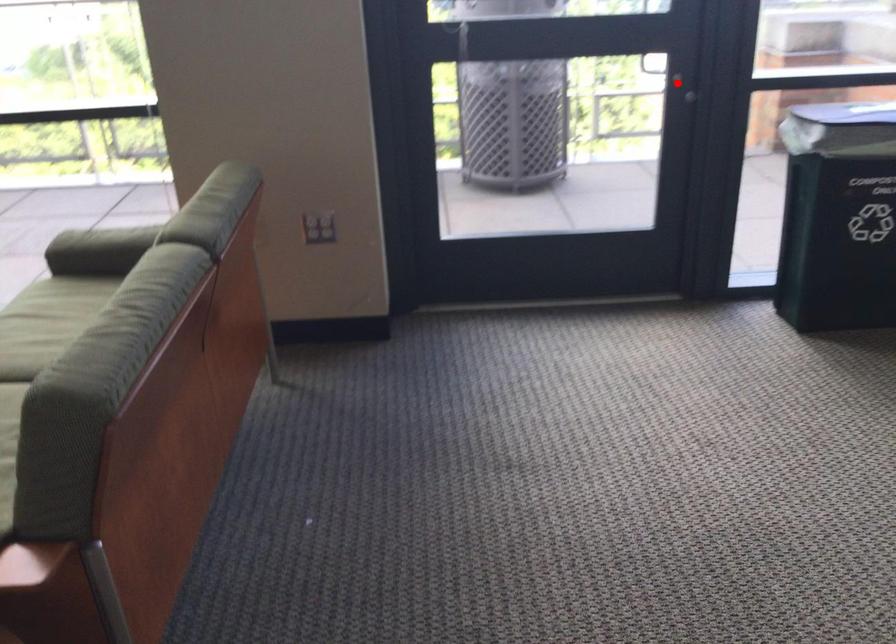
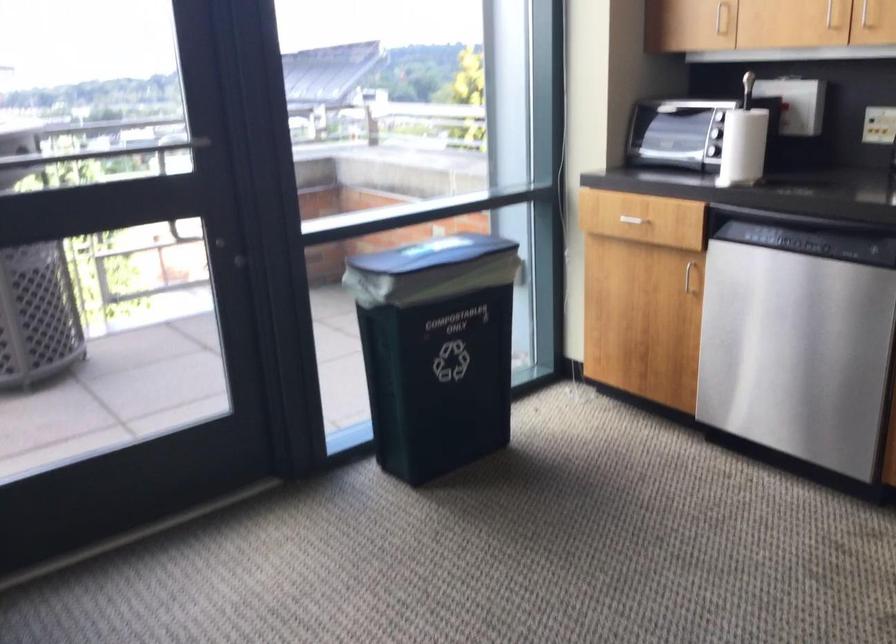
Find the pixel in the second image that matches the highlighted location in the first image.

(231, 254)